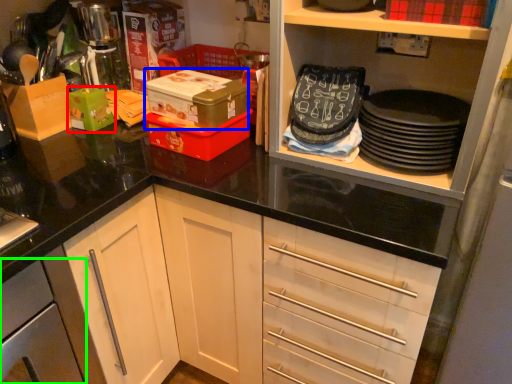
Question: Which object is the farthest from box (highlighted by a red box)? Choose among these: box (highlighted by a blue box) or cabinetry (highlighted by a green box).

Choices:
 (A) box
 (B) cabinetry

Answer: (B)